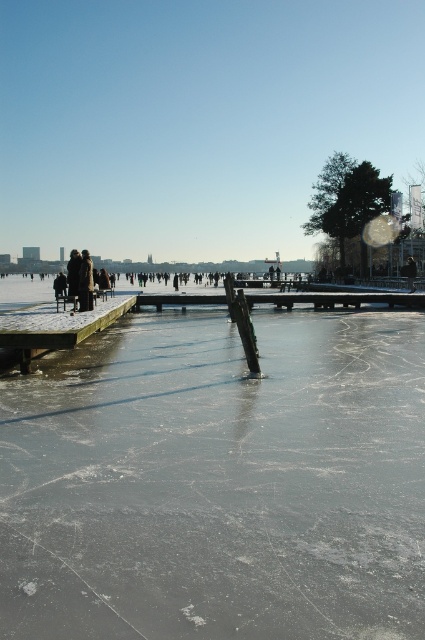
You are planning to walk across the wooden dock at left while carrying a large backpack. Considering the width of the dock and the space taken by the dark brown leather jacket at left, do you think you can pass safely without falling into the icy water?

The wooden dock at left is wider than the dark brown leather jacket at left, so there should be enough space to pass safely while carrying your backpack.